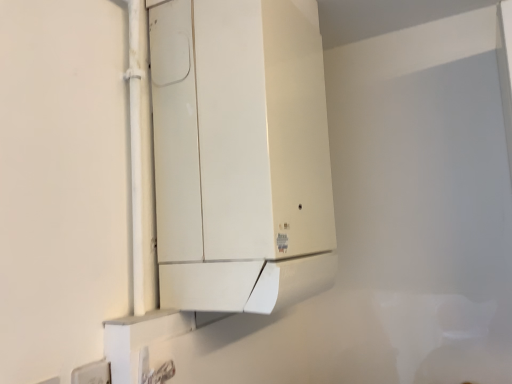
In order to face white matte cabinet at center, should I rotate leftwards or rightwards?

Rotate left and turn 0.243 degrees.

At what (x,y) coordinates should I click in order to perform the action: click on white matte cabinet at center. Please return your answer as a coordinate pair (x, y). Looking at the image, I should click on (240, 154).

This screenshot has height=384, width=512. Describe the element at coordinates (240, 154) in the screenshot. I see `white matte cabinet at center` at that location.

Identify the location of white plastic electric outlet at lower left. The height and width of the screenshot is (384, 512). (92, 373).

Image resolution: width=512 pixels, height=384 pixels. What do you see at coordinates (92, 373) in the screenshot?
I see `white plastic electric outlet at lower left` at bounding box center [92, 373].

Identify the location of white matte cabinet at center. (240, 154).

Is white matte cabinet at center to the left of white plastic electric outlet at lower left from the viewer's perspective?

No.

In the scene shown: Does white matte cabinet at center come behind white plastic electric outlet at lower left?

That is True.

Which is nearer, [245,297] or [109,368]?

The point [109,368] is closer to the camera.

From the image's perspective, relative to white plastic electric outlet at lower left, is white matte cabinet at center above or below?

Based on their image positions, white matte cabinet at center is located above white plastic electric outlet at lower left.

From a real-world perspective, does white matte cabinet at center sit lower than white plastic electric outlet at lower left?

No, from a real-world perspective, white matte cabinet at center is not under white plastic electric outlet at lower left.

Which of these two, white matte cabinet at center or white plastic electric outlet at lower left, is wider?

white matte cabinet at center.

Between white matte cabinet at center and white plastic electric outlet at lower left, which one has more height?

With more height is white matte cabinet at center.

Looking at this image, does white matte cabinet at center have a smaller size compared to white plastic electric outlet at lower left?

Incorrect, white matte cabinet at center is not smaller in size than white plastic electric outlet at lower left.

Looking at this image, is white matte cabinet at center spatially inside white plastic electric outlet at lower left, or outside of it?

white matte cabinet at center is outside white plastic electric outlet at lower left.

Is white matte cabinet at center far from white plastic electric outlet at lower left?

white matte cabinet at center is actually quite close to white plastic electric outlet at lower left.

Is white matte cabinet at center turned away from white plastic electric outlet at lower left?

That's not correct — white matte cabinet at center is not looking away from white plastic electric outlet at lower left.

Where is `cabinetry lying on the right of white plastic electric outlet at lower left`? The height and width of the screenshot is (384, 512). cabinetry lying on the right of white plastic electric outlet at lower left is located at coordinates (240, 154).

Can you confirm if white plastic electric outlet at lower left is positioned to the left of white matte cabinet at center?

Indeed, white plastic electric outlet at lower left is positioned on the left side of white matte cabinet at center.

Which is behind, white plastic electric outlet at lower left or white matte cabinet at center?

white matte cabinet at center is further away from the camera.

Considering the positions of point (106, 382) and point (179, 75), is point (106, 382) closer or farther from the camera than point (179, 75)?

Point (106, 382).

From the image's perspective, which one is positioned lower, white plastic electric outlet at lower left or white matte cabinet at center?

white plastic electric outlet at lower left is shown below in the image.

From a real-world perspective, is white plastic electric outlet at lower left physically located above or below white matte cabinet at center?

From a real-world perspective, white plastic electric outlet at lower left is physically below white matte cabinet at center.

Looking at this image, does white plastic electric outlet at lower left have a lesser width compared to white matte cabinet at center?

Yes.

Who is taller, white plastic electric outlet at lower left or white matte cabinet at center?

white matte cabinet at center.

Considering the sizes of objects white plastic electric outlet at lower left and white matte cabinet at center in the image provided, who is bigger, white plastic electric outlet at lower left or white matte cabinet at center?

With larger size is white matte cabinet at center.

Can we say white plastic electric outlet at lower left lies outside white matte cabinet at center?

Indeed, white plastic electric outlet at lower left is completely outside white matte cabinet at center.

Is the surface of white plastic electric outlet at lower left in direct contact with white matte cabinet at center?

No.

Is white matte cabinet at center at the back of white plastic electric outlet at lower left?

That's not correct — white plastic electric outlet at lower left is not looking away from white matte cabinet at center.

Find the location of `cabinetry located above the white plastic electric outlet at lower left (from a real-world perspective)`. cabinetry located above the white plastic electric outlet at lower left (from a real-world perspective) is located at coordinates (240, 154).

You are a GUI agent. You are given a task and a screenshot of the screen. Output one action in this format:
    pyautogui.click(x=<x>, y=<y>)
    Task: Click on the electric outlet on the left of white matte cabinet at center
    Image resolution: width=512 pixels, height=384 pixels.
    Given the screenshot: What is the action you would take?
    pyautogui.click(x=92, y=373)

The image size is (512, 384). Find the location of `electric outlet below the white matte cabinet at center (from a real-world perspective)`. electric outlet below the white matte cabinet at center (from a real-world perspective) is located at coordinates (92, 373).